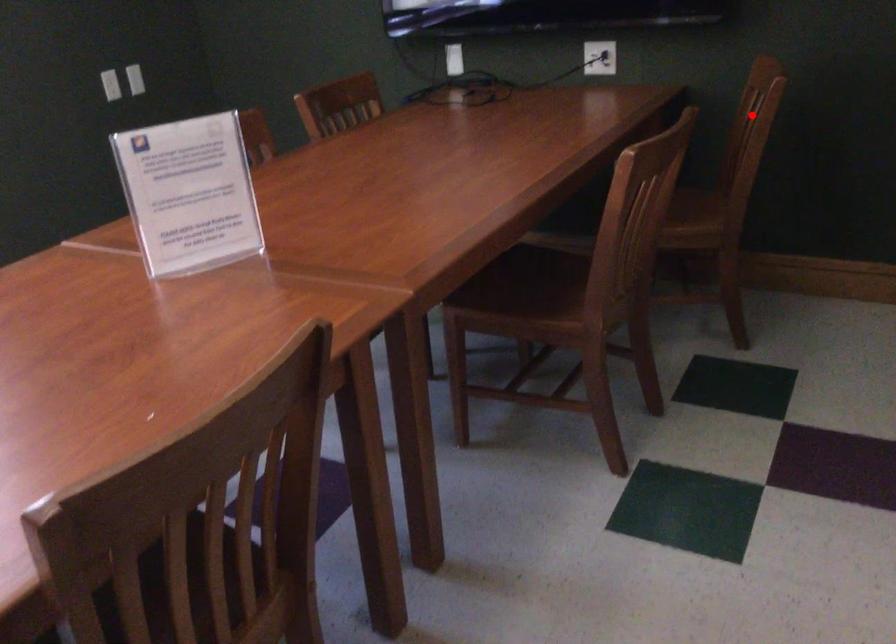
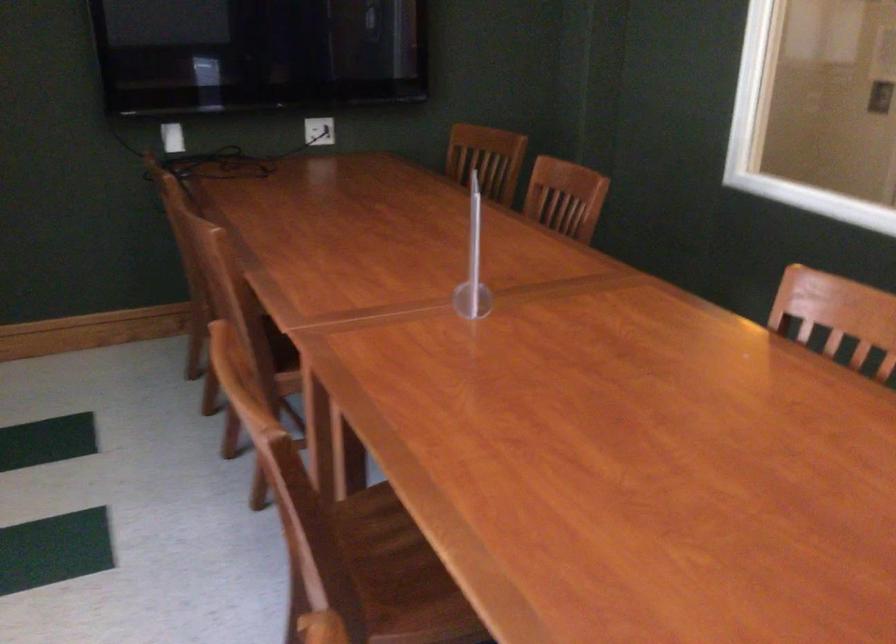
Find the pixel in the second image that matches the highlighted location in the first image.

(487, 158)